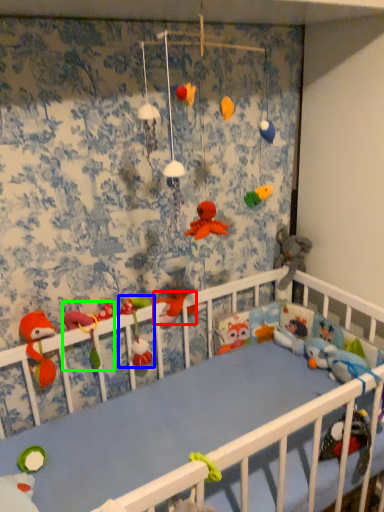
Question: Estimate the real-world distances between objects in this image. Which object is closer to toy (highlighted by a red box), toy (highlighted by a blue box) or toy (highlighted by a green box)?

Choices:
 (A) toy
 (B) toy

Answer: (A)